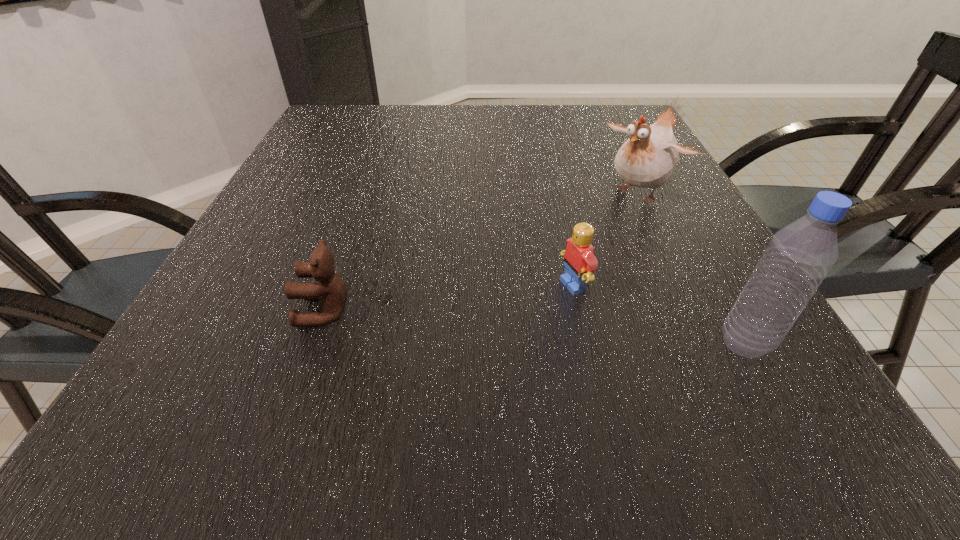
This screenshot has height=540, width=960. What are the coordinates of `vacant position located at the beak of the third shortest object` in the screenshot? It's located at (562, 253).

The width and height of the screenshot is (960, 540). In order to click on vacant area located 0.390m at the beak of the third shortest object in this screenshot , I will do [494, 308].

The height and width of the screenshot is (540, 960). I want to click on vacant point located on the front-facing side of the second object from left to right, so tap(482, 319).

This screenshot has height=540, width=960. I want to click on free space located 0.390m on the front-facing side of the second object from left to right, so tap(328, 372).

The image size is (960, 540). In order to click on vacant space located 0.390m on the front-facing side of the second object from left to right in this screenshot , I will do 328,372.

Where is `teddy bear situated at the near edge`? The width and height of the screenshot is (960, 540). teddy bear situated at the near edge is located at coordinates (331, 291).

You are a GUI agent. You are given a task and a screenshot of the screen. Output one action in this format:
    pyautogui.click(x=<x>, y=<y>)
    Task: Click on the bottle present at the near edge
    
    Given the screenshot: What is the action you would take?
    pyautogui.click(x=799, y=256)

Find the location of a particular element. bottle that is at the right edge is located at coordinates (799, 256).

This screenshot has height=540, width=960. Find the location of `bird situated at the right edge`. bird situated at the right edge is located at coordinates (648, 158).

I want to click on object at the near right corner, so click(x=799, y=256).